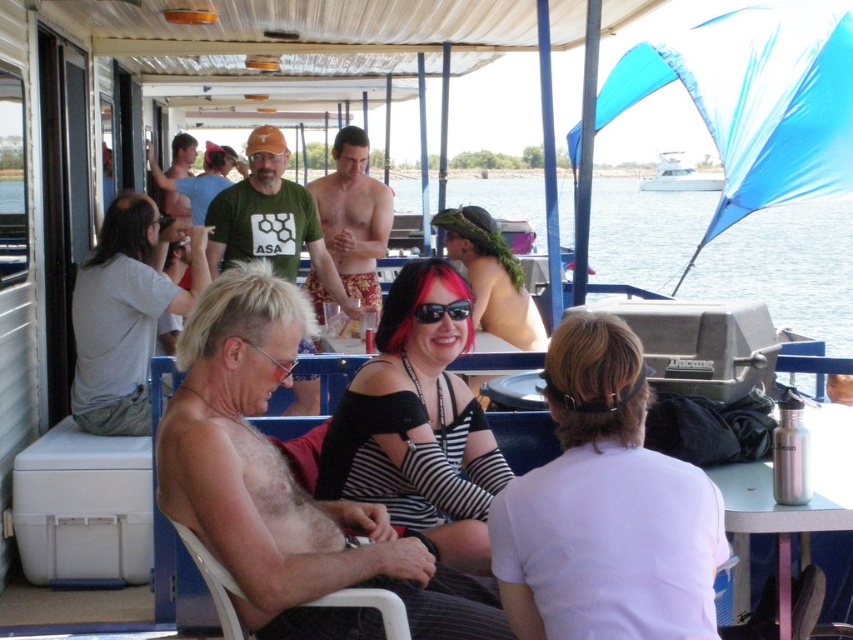
You are a photographer on the boat and want to capture a photo of the yellow patterned shorts at center and the white glossy boat at upper center. Which object is narrower in your camera view?

The yellow patterned shorts at center is thinner than the white glossy boat at upper center, so it is narrower in the camera view.